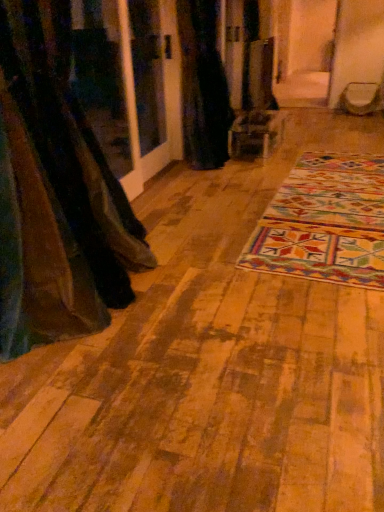
Question: From a real-world perspective, relative to multicolored woven mat at center, is black fabric curtain at center, marked as the 1th curtain in a right-to-left arrangement, vertically above or below?

Choices:
 (A) above
 (B) below

Answer: (A)

Question: Relative to multicolored woven mat at center, is black fabric curtain at center, marked as the 1th curtain in a right-to-left arrangement, in front or behind?

Choices:
 (A) front
 (B) behind

Answer: (B)

Question: Based on their relative distances, which object is nearer to the brown fabric curtain at left, the 1th curtain viewed from the front?

Choices:
 (A) black fabric curtain at center, placed as the 1th curtain when sorted from top to bottom
 (B) multicolored woven mat at center

Answer: (B)

Question: Which is farther from the black fabric curtain at center, marked as the second curtain in a left-to-right arrangement?

Choices:
 (A) multicolored woven mat at center
 (B) brown fabric curtain at left, which is counted as the 1th curtain, starting from the left

Answer: (B)